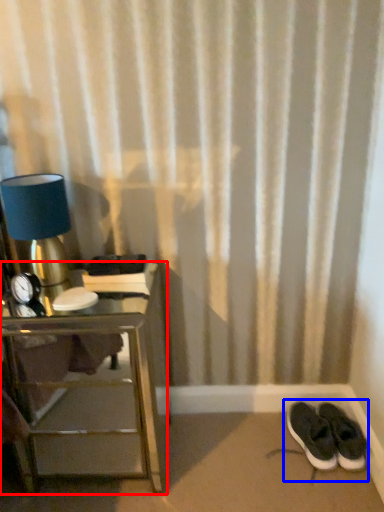
Question: Among these objects, which one is nearest to the camera, nightstand (highlighted by a red box) or footwear (highlighted by a blue box)?

Choices:
 (A) nightstand
 (B) footwear

Answer: (A)